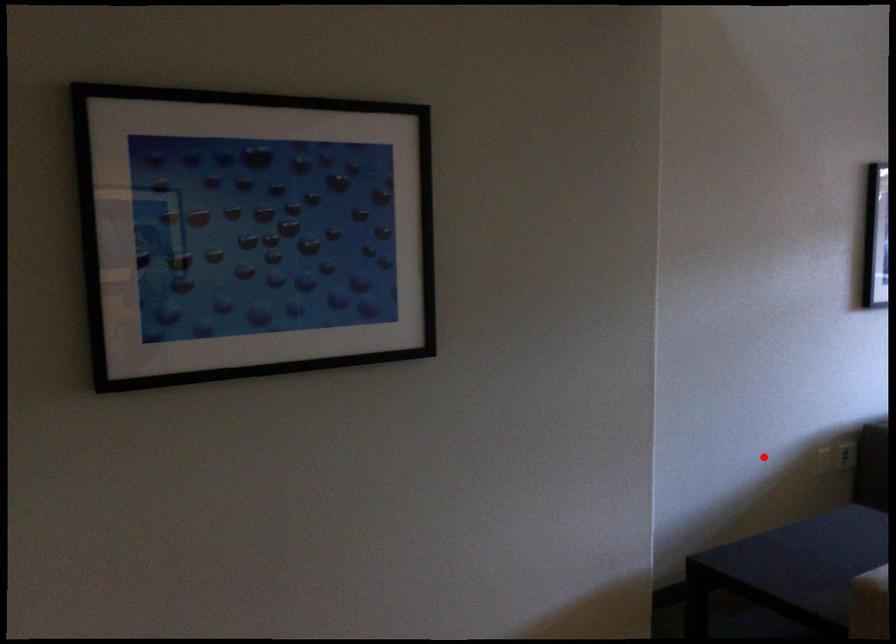
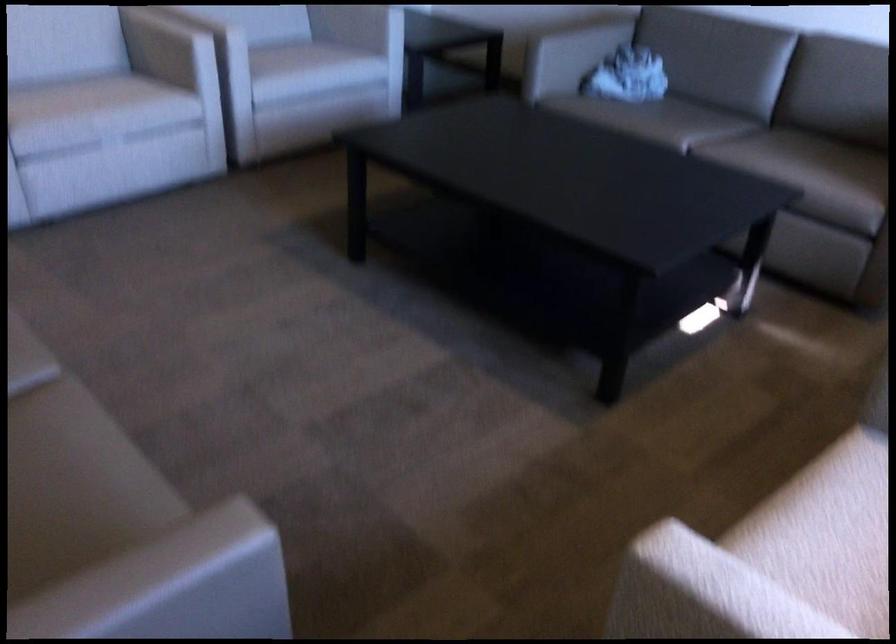
Find the pixel in the second image that matches the highlighted location in the first image.

(556, 26)